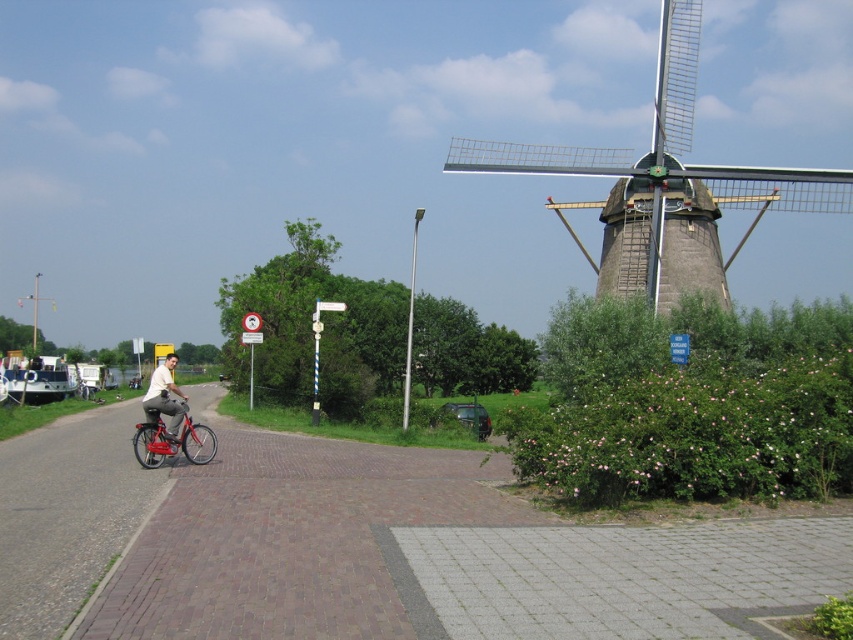
Is metallic red bicycle at left to the left of matte white shirt at center from the viewer's perspective?

Incorrect, metallic red bicycle at left is not on the left side of matte white shirt at center.

Does metallic red bicycle at left have a larger size compared to matte white shirt at center?

Actually, metallic red bicycle at left might be smaller than matte white shirt at center.

In order to click on metallic red bicycle at left in this screenshot , I will do `click(170, 440)`.

Is point (602, 154) positioned behind point (165, 358)?

Yes.

Identify the location of gray stone windmill at upper right. (662, 148).

I want to click on gray stone windmill at upper right, so click(x=662, y=148).

In the scene shown: Between gray stone windmill at upper right and metallic red bicycle at left, which one appears on the left side from the viewer's perspective?

metallic red bicycle at left

Does gray stone windmill at upper right have a lesser width compared to metallic red bicycle at left?

Incorrect, gray stone windmill at upper right's width is not less than metallic red bicycle at left's.

Does point (693, 64) come behind point (194, 436)?

Yes, point (693, 64) is farther from viewer.

Image resolution: width=853 pixels, height=640 pixels. What are the coordinates of `gray stone windmill at upper right` in the screenshot? It's located at (662, 148).